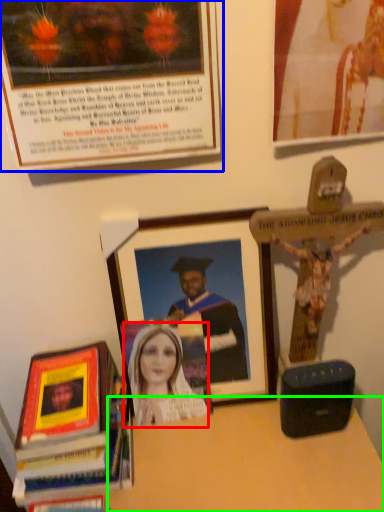
Question: Which object is positioned closest to woman (highlighted by a red box)? Select from picture frame (highlighted by a blue box) and table (highlighted by a green box).

Choices:
 (A) picture frame
 (B) table

Answer: (B)